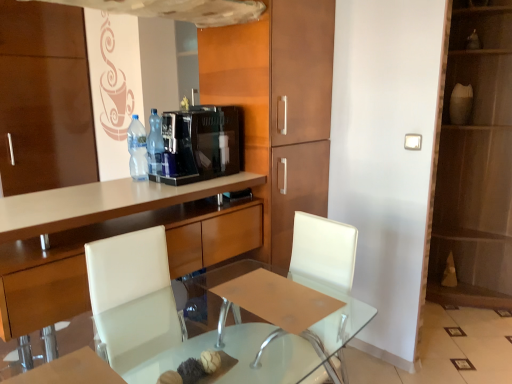
I want to click on free space in front of translucent plastic bottle at center, which is the first bottle from right to left, so click(141, 183).